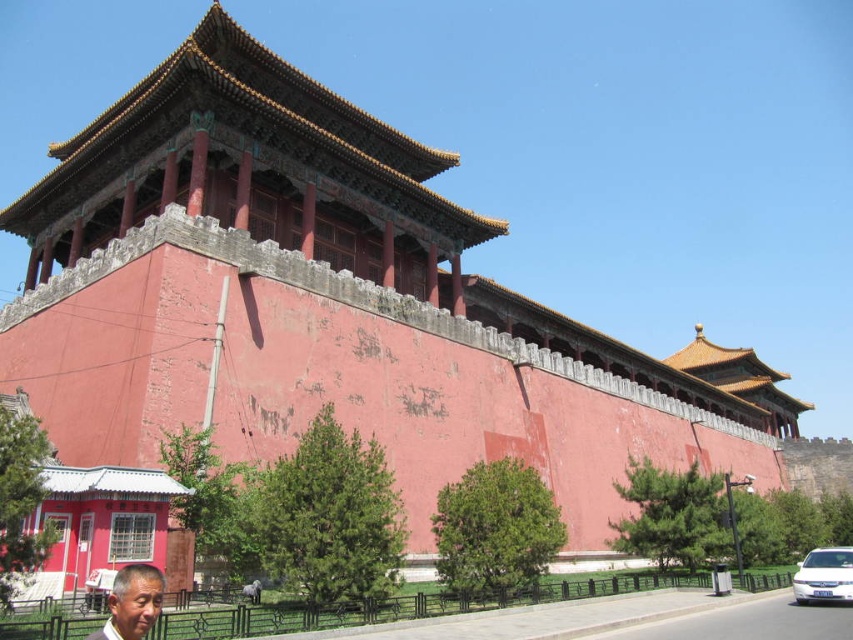
Question: Which of the following is the closest to the observer?

Choices:
 (A) matte gray face at lower left
 (B) white glossy minivan at lower right

Answer: (A)

Question: Which point is closer to the camera taking this photo?

Choices:
 (A) (827, 572)
 (B) (155, 572)

Answer: (B)

Question: Is matte gray face at lower left behind white glossy minivan at lower right?

Choices:
 (A) yes
 (B) no

Answer: (B)

Question: Which object appears farthest from the camera in this image?

Choices:
 (A) matte gray face at lower left
 (B) white glossy minivan at lower right

Answer: (B)

Question: From the image, what is the correct spatial relationship of matte gray face at lower left in relation to white glossy minivan at lower right?

Choices:
 (A) above
 (B) below

Answer: (A)

Question: Is matte gray face at lower left bigger than white glossy minivan at lower right?

Choices:
 (A) no
 (B) yes

Answer: (A)